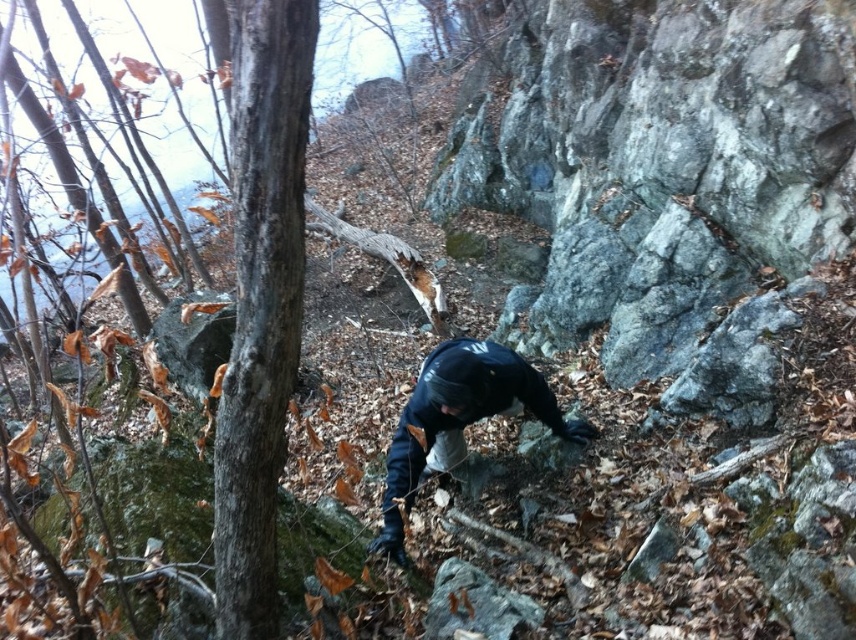
The height and width of the screenshot is (640, 856). What are the coordinates of `smooth brown bark at center` in the screenshot? It's located at (260, 296).

Is the position of smooth brown bark at center less distant than that of dark blue jacket at center?

Yes, it is in front of dark blue jacket at center.

Is point (266, 440) less distant than point (461, 442)?

Yes, point (266, 440) is closer to viewer.

This screenshot has height=640, width=856. Identify the location of smooth brown bark at center. (260, 296).

Locate an element on the screen. smooth bark tree at center is located at coordinates (262, 301).

Can you confirm if smooth bark tree at center is positioned below dark blue jacket at center?

Incorrect, smooth bark tree at center is not positioned below dark blue jacket at center.

Who is more distant from viewer, [310,16] or [480,387]?

The point [480,387] is more distant.

You are a GUI agent. You are given a task and a screenshot of the screen. Output one action in this format:
    pyautogui.click(x=<x>, y=<y>)
    Task: Click on the smooth bark tree at center
    
    Given the screenshot: What is the action you would take?
    pyautogui.click(x=262, y=301)

Is smooth brown bark at center to the right of smooth bark tree at center from the viewer's perspective?

Incorrect, smooth brown bark at center is not on the right side of smooth bark tree at center.

Is point (244, 17) behind point (290, 48)?

No.

Is point (269, 483) farther from viewer compared to point (286, 236)?

Yes, point (269, 483) is farther from viewer.

I want to click on smooth brown bark at center, so click(x=260, y=296).